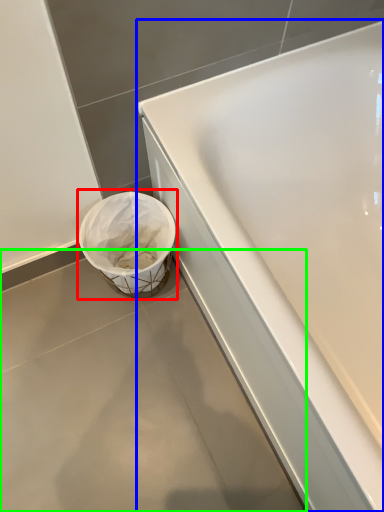
Question: Considering the real-world distances, which object is closest to waste container (highlighted by a red box)? bathtub (highlighted by a blue box) or concrete (highlighted by a green box).

Choices:
 (A) bathtub
 (B) concrete

Answer: (B)